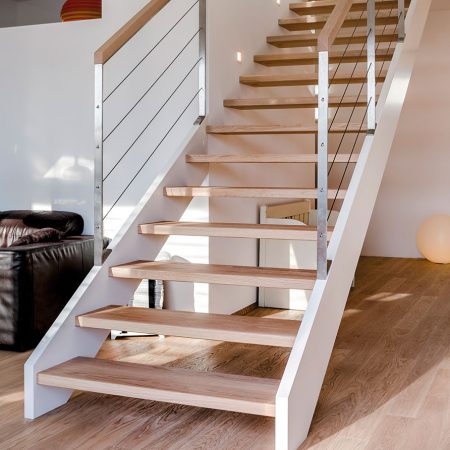
Where is `stair railing wires`? Image resolution: width=450 pixels, height=450 pixels. stair railing wires is located at coordinates (130, 72), (142, 96), (152, 119), (162, 137), (335, 70), (345, 92), (350, 111), (358, 134).